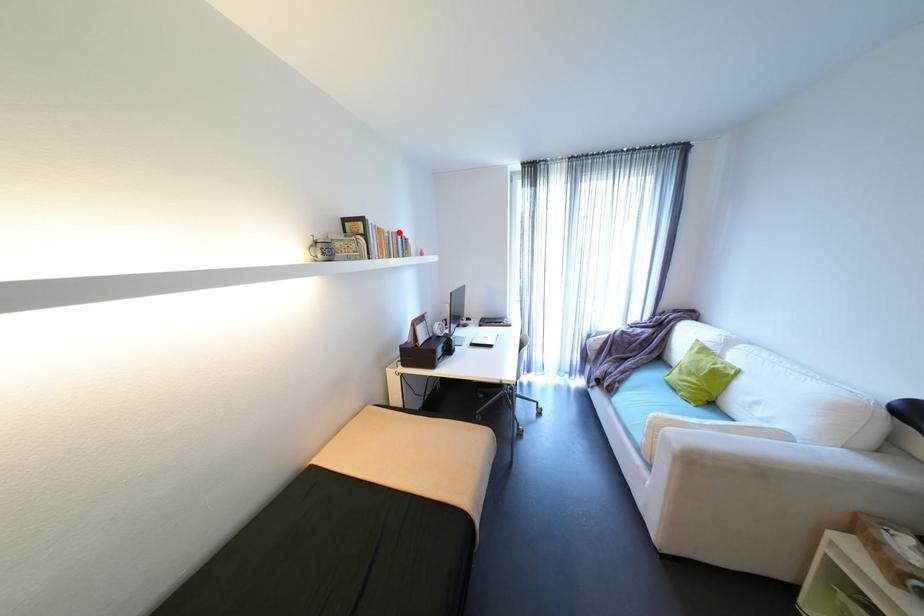
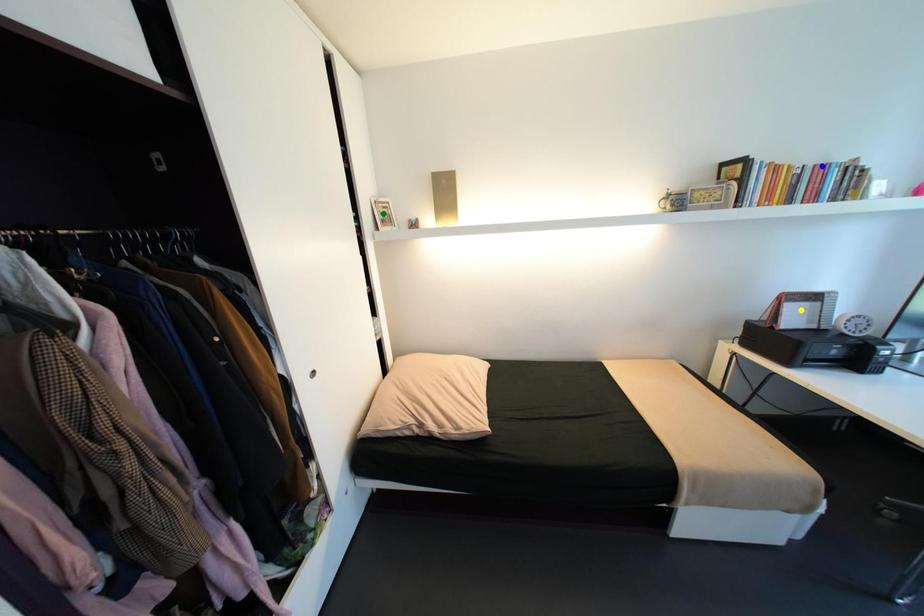
Question: I am providing you with two images of the same scene from different viewpoints. A red point is marked on the first image. You are given multiple points on the second image. Which point in image 2 represents the same 3d spot as the red point in image 1?

Choices:
 (A) blue point
 (B) green point
 (C) yellow point

Answer: (A)